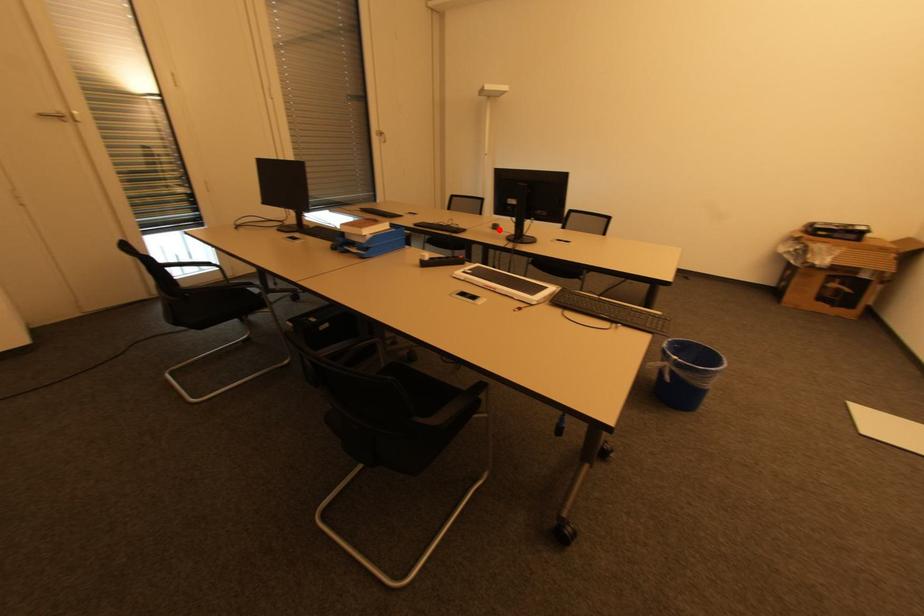
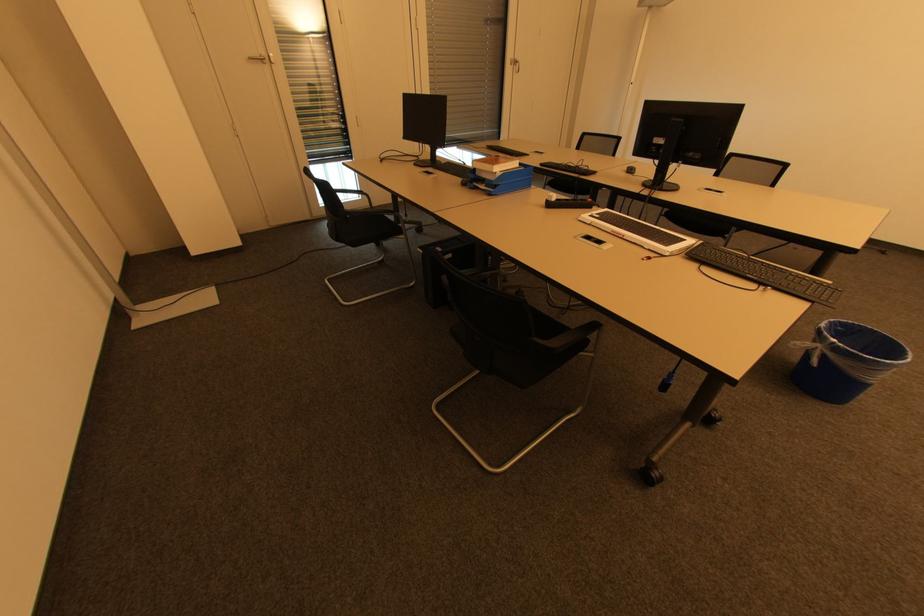
Question: I am providing you with two images of the same scene from different viewpoints. A red point is shown in image1. For the corresponding object point in image2, is it positioned nearer or farther from the camera?

Choices:
 (A) Nearer
 (B) Farther

Answer: (A)